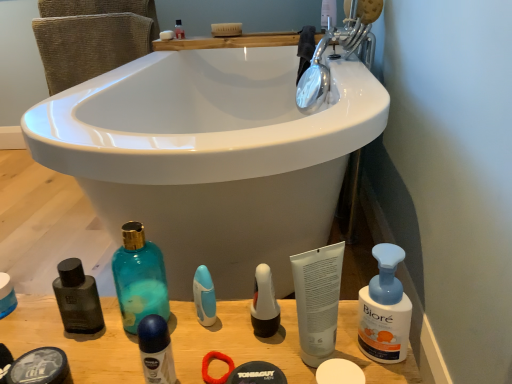
Question: From the image's perspective, is white glossy pump bottle at center, the third toiletry viewed from the back, located above or below teal glass bottle at lower left, the first cleaning product viewed from the left?

Choices:
 (A) below
 (B) above

Answer: (A)

Question: From a real-world perspective, is white glossy pump bottle at center, the 4th toiletry from the bottom, above or below teal glass bottle at lower left, positioned as the second cleaning product in right-to-left order?

Choices:
 (A) below
 (B) above

Answer: (A)

Question: Estimate the real-world distances between objects in this image. Which object is farther from the silver metallic faucet at upper right?

Choices:
 (A) white matte soap at lower center, which is counted as the 2th soap, starting from the left
 (B) white glossy pump bottle at center, which appears as the 4th toiletry when viewed from the front
 (C) white matte soap at upper center, which is counted as the first soap, starting from the back
 (D) blue matte deodorant at center, positioned as the 3th toiletry in left-to-right order
 (E) matte black bottle at lower left

Answer: (E)

Question: Which of these objects is positioned closest to the matte black shaving cream at lower left, which appears as the first toiletry when ordered from the bottom?

Choices:
 (A) white matte soap at upper center, which is the second soap from front to back
 (B) white glossy pump bottle at center, the third toiletry viewed from the back
 (C) white matte tube at center, arranged as the second toiletry when viewed from the top
 (D) blue plastic toothbrush at center, positioned as the second toiletry in back-to-front order
 (E) teal glass bottle at lower left, positioned as the second cleaning product in right-to-left order

Answer: (E)